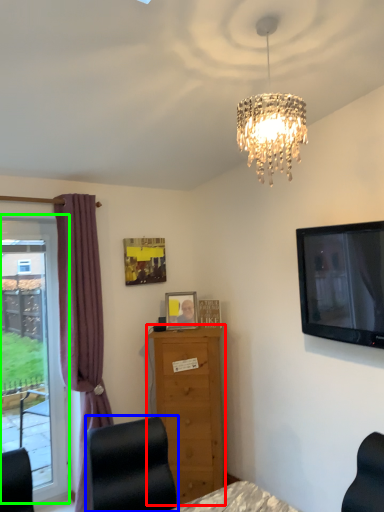
Question: Which object is the farthest from chest of drawers (highlighted by a red box)? Choose among these: furniture (highlighted by a blue box) or window (highlighted by a green box).

Choices:
 (A) furniture
 (B) window

Answer: (A)